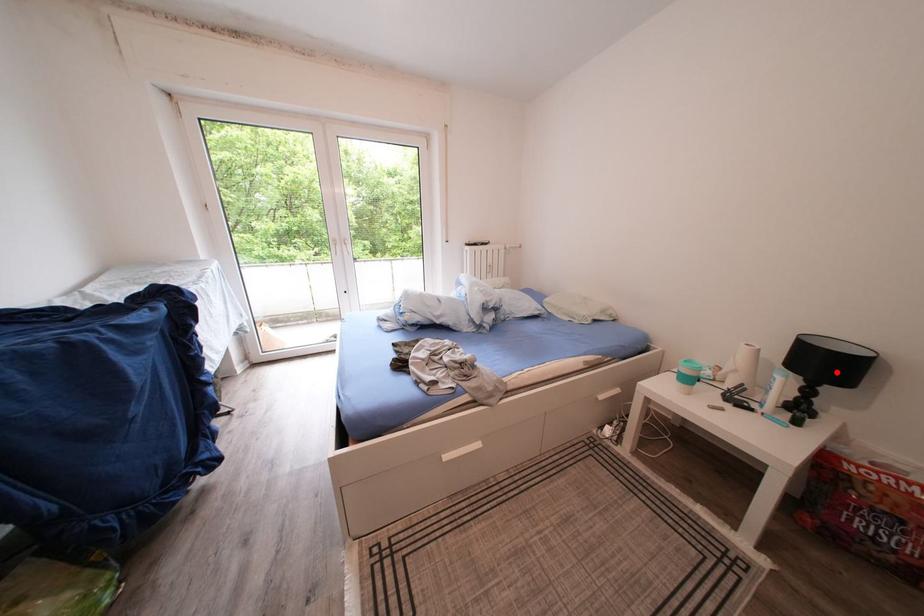
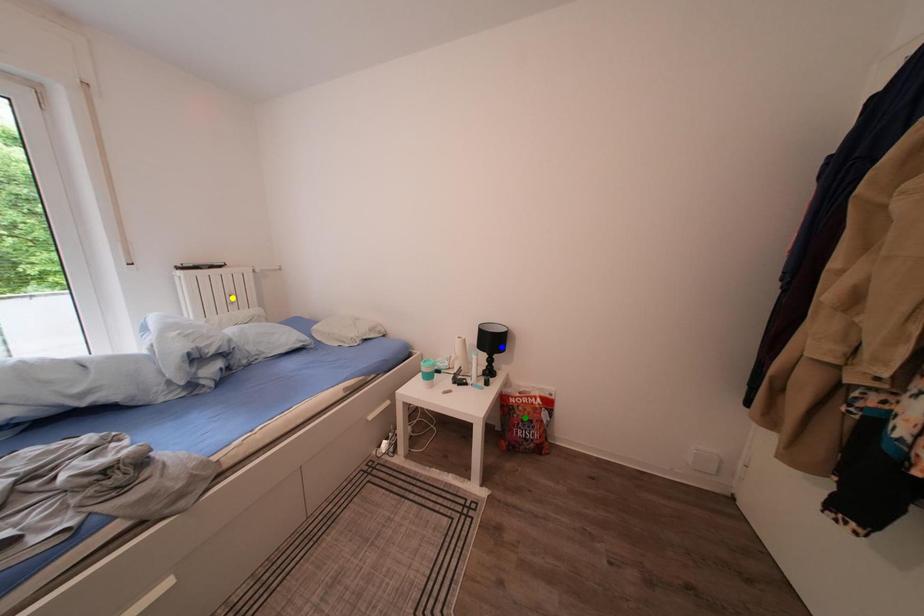
Question: I am providing you with two images of the same scene from different viewpoints. A red point is marked on the first image. You are given multiple points on the second image. Which spot in image 2 lines up with the point in image 1?

Choices:
 (A) blue point
 (B) green point
 (C) yellow point

Answer: (A)